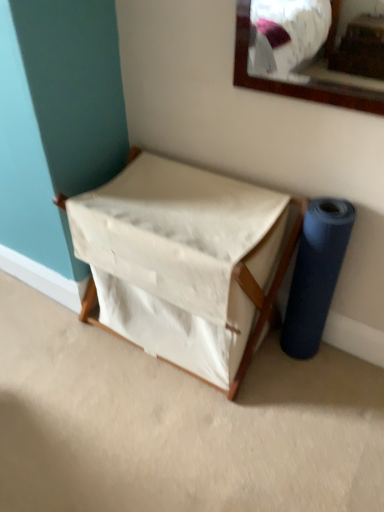
Question: Is blue rubber roll at right far away from white canvas laundry basket at center?

Choices:
 (A) yes
 (B) no

Answer: (B)

Question: Considering the relative sizes of blue rubber roll at right and white canvas laundry basket at center in the image provided, is blue rubber roll at right bigger than white canvas laundry basket at center?

Choices:
 (A) no
 (B) yes

Answer: (A)

Question: Does blue rubber roll at right have a greater height compared to white canvas laundry basket at center?

Choices:
 (A) yes
 (B) no

Answer: (A)

Question: Is blue rubber roll at right facing away from white canvas laundry basket at center?

Choices:
 (A) no
 (B) yes

Answer: (A)

Question: Would you say blue rubber roll at right is outside white canvas laundry basket at center?

Choices:
 (A) no
 (B) yes

Answer: (B)

Question: From the image's perspective, is blue rubber roll at right located beneath white canvas laundry basket at center?

Choices:
 (A) yes
 (B) no

Answer: (A)

Question: Can we say white canvas laundry basket at center lies outside blue rubber roll at right?

Choices:
 (A) no
 (B) yes

Answer: (B)

Question: Does white canvas laundry basket at center have a lesser width compared to blue rubber roll at right?

Choices:
 (A) yes
 (B) no

Answer: (B)

Question: Is the depth of white canvas laundry basket at center less than that of blue rubber roll at right?

Choices:
 (A) yes
 (B) no

Answer: (A)

Question: Is white canvas laundry basket at center facing towards blue rubber roll at right?

Choices:
 (A) yes
 (B) no

Answer: (B)

Question: Does white canvas laundry basket at center touch blue rubber roll at right?

Choices:
 (A) yes
 (B) no

Answer: (B)

Question: Would you consider white canvas laundry basket at center to be distant from blue rubber roll at right?

Choices:
 (A) no
 (B) yes

Answer: (A)

Question: Visually, is blue rubber roll at right positioned to the left or to the right of white canvas laundry basket at center?

Choices:
 (A) right
 (B) left

Answer: (A)